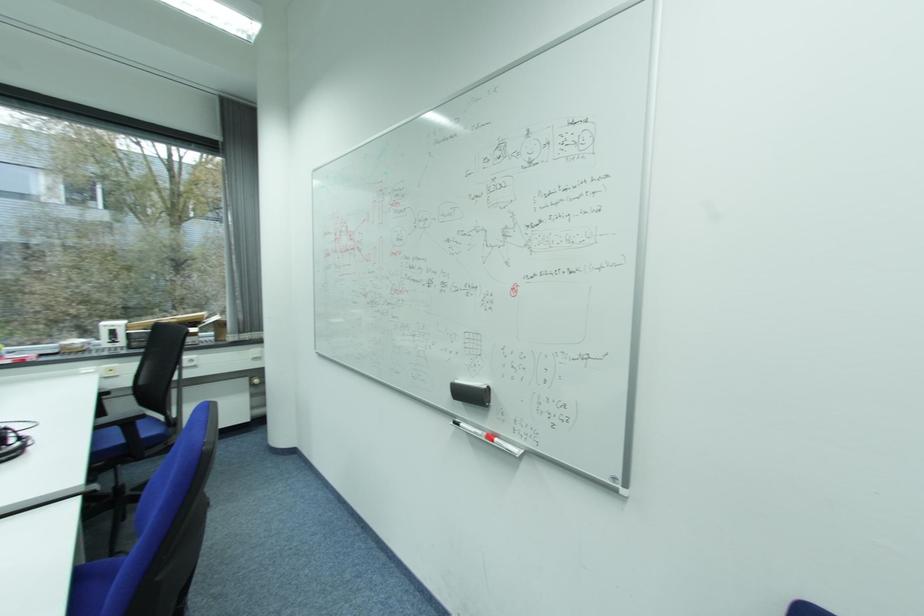
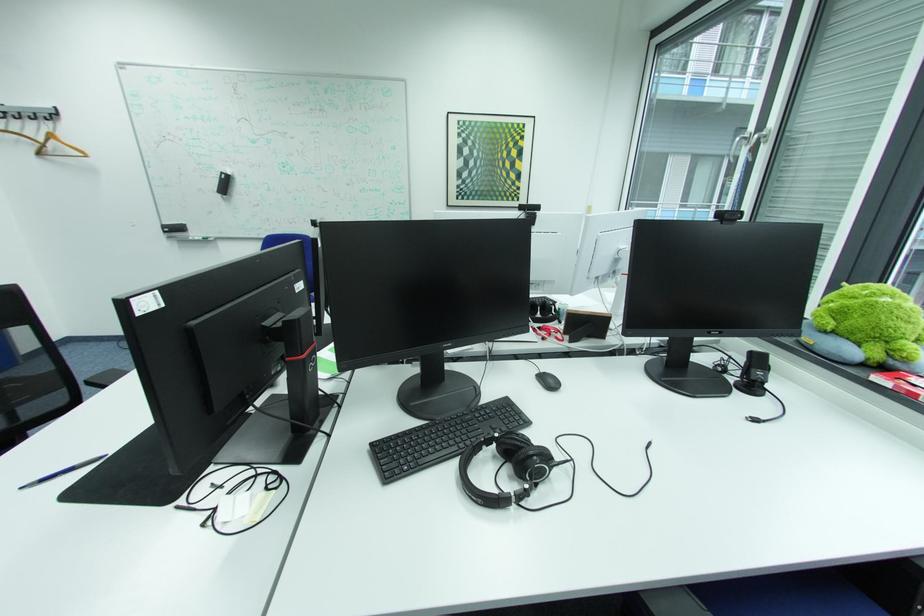
Locate, in the second image, the point that corresponds to (28,453) in the first image.

(489, 501)